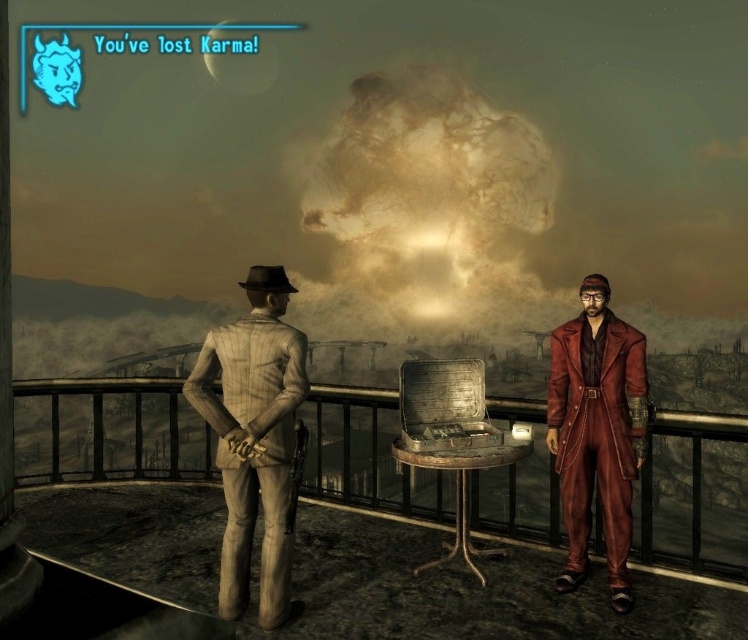
You are a game developer analyzing character positioning in a post apocalyptic scene. The scene includes a light brown striped suit at left and a leather coat at right. Which character is shorter?

The light brown striped suit at left is shorter than the leather coat at right.

You are a game developer analyzing character sizes for a cutscene. The scene requires both the light brown striped suit at left and the leather coat at right to be framed together. Which character should be placed closer to the camera to maintain proportional representation?

The light brown striped suit at left should be placed closer to the camera because its width surpasses that of the leather coat at right, ensuring both appear proportionally sized in the frame.

You are a character in the game who needs to jump from the balcony to the ground below. The light brown striped suit at left and the leather coat at right are on the edge of the balcony. Which one is closer to the edge?

The light brown striped suit at left is positioned over the leather coat at right, meaning it is closer to the edge of the balcony.